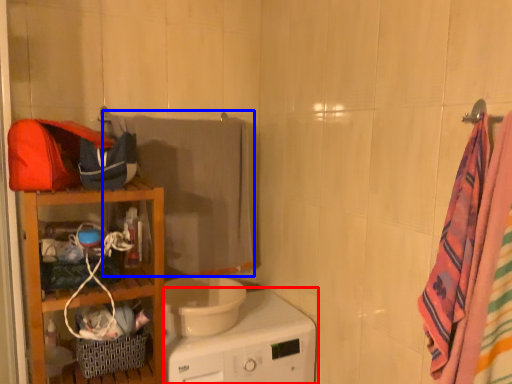
Question: Among these objects, which one is farthest to the camera, home appliance (highlighted by a red box) or beach towel (highlighted by a blue box)?

Choices:
 (A) home appliance
 (B) beach towel

Answer: (B)